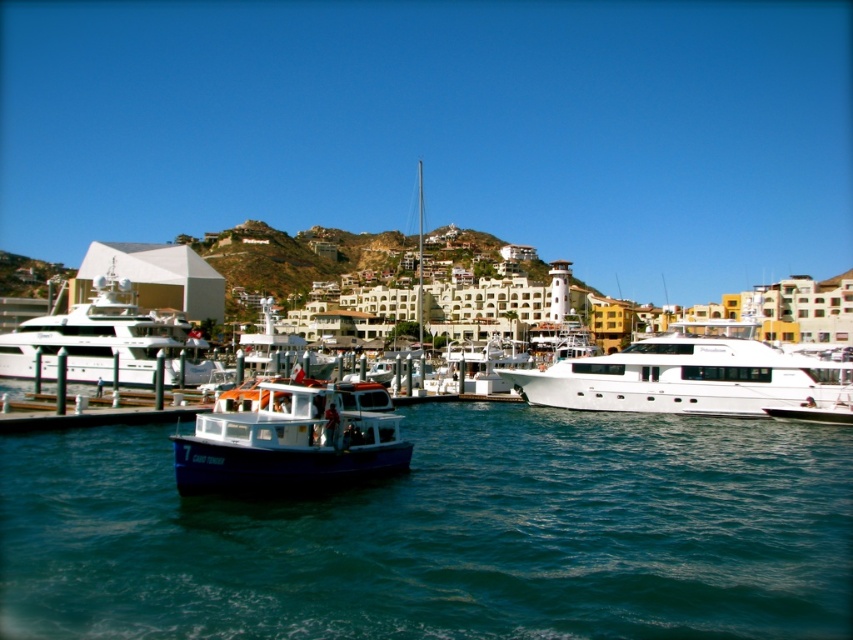
Question: Does blue water at center have a larger size compared to white glossy yacht at right?

Choices:
 (A) no
 (B) yes

Answer: (B)

Question: Which point is closer to the camera?

Choices:
 (A) blue matte boat at center
 (B) white glossy yacht at left

Answer: (A)

Question: Which of the following is the closest to the observer?

Choices:
 (A) blue matte boat at center
 (B) white glossy yacht at left
 (C) blue water at center

Answer: (C)

Question: Is blue water at center behind blue matte boat at center?

Choices:
 (A) yes
 (B) no

Answer: (B)

Question: Estimate the real-world distances between objects in this image. Which object is closer to the white glossy yacht at left?

Choices:
 (A) blue water at center
 (B) white glossy yacht at right

Answer: (A)

Question: Does white glossy yacht at right lie behind blue matte boat at center?

Choices:
 (A) yes
 (B) no

Answer: (A)